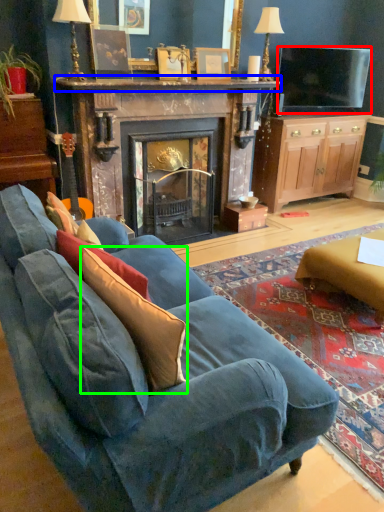
Question: Considering the real-world distances, which object is farthest from television (highlighted by a red box)? mantle (highlighted by a blue box) or throw pillow (highlighted by a green box)?

Choices:
 (A) mantle
 (B) throw pillow

Answer: (B)